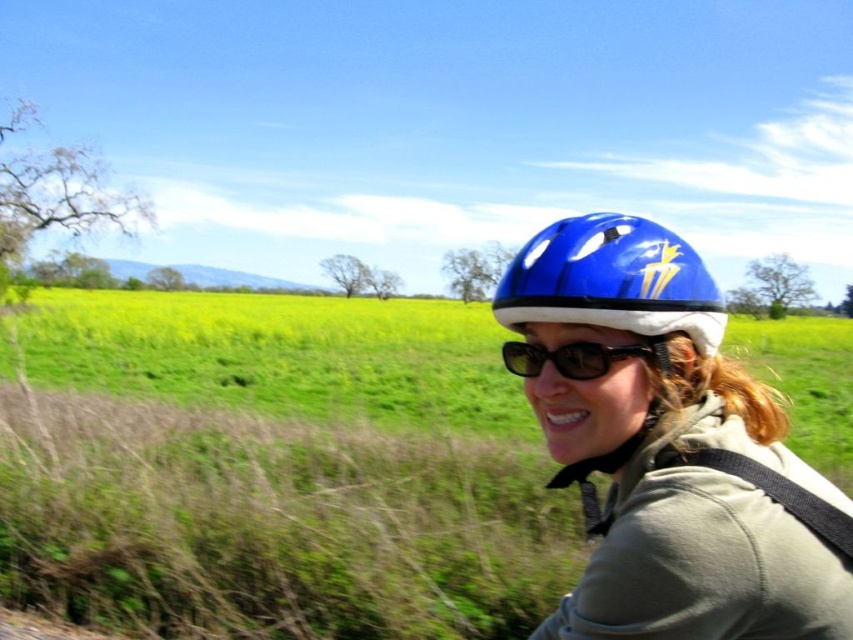
Question: Considering the relative positions of green grass at center and blue matte helmet at upper right in the image provided, where is green grass at center located with respect to blue matte helmet at upper right?

Choices:
 (A) above
 (B) below

Answer: (A)

Question: Which point is closer to the camera taking this photo?

Choices:
 (A) (614, 259)
 (B) (660, 563)

Answer: (B)

Question: Which of the following is the closest to the observer?

Choices:
 (A) (541, 486)
 (B) (561, 368)

Answer: (B)

Question: In this image, where is blue matte helmet at center located relative to black plastic sunglasses at center?

Choices:
 (A) left
 (B) right

Answer: (B)

Question: Can you confirm if green grass at center is positioned to the right of blue matte helmet at upper right?

Choices:
 (A) no
 (B) yes

Answer: (A)

Question: Which point is farther to the camera?

Choices:
 (A) (642, 376)
 (B) (292, 356)
 (C) (630, 353)
 (D) (616, 230)

Answer: (B)